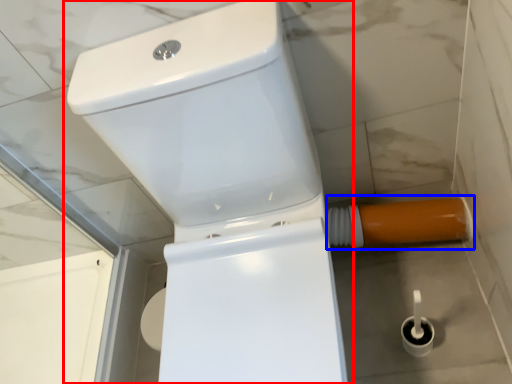
Question: Which point is closer to the camera, toilet (highlighted by a red box) or water pipe (highlighted by a blue box)?

Choices:
 (A) toilet
 (B) water pipe

Answer: (A)